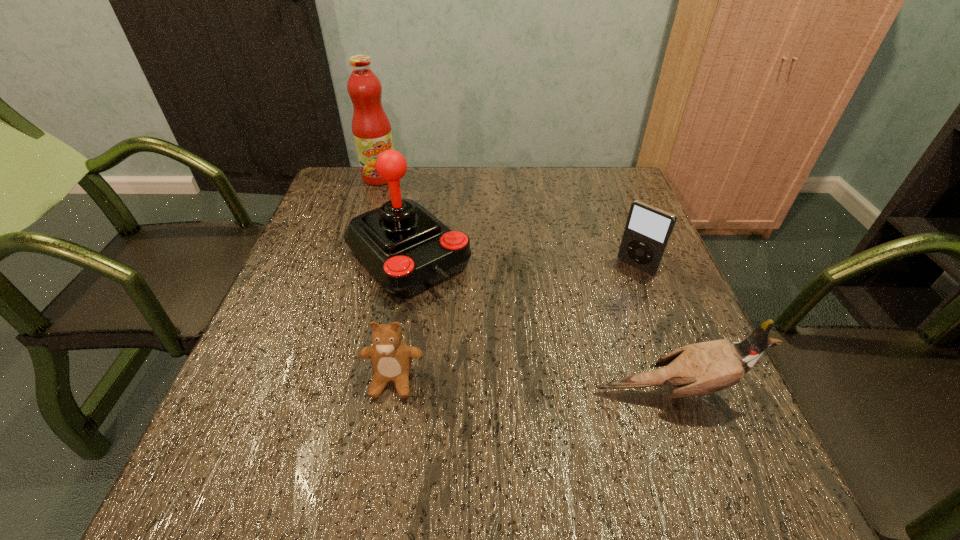
Find the location of `object that is the nearest to the second tallest object`. object that is the nearest to the second tallest object is located at coordinates (391, 358).

Where is `free space that satisfies the following two spatial constraints: 1. on the front-facing side of the shortest object; 2. at the face of the bird`? This screenshot has width=960, height=540. free space that satisfies the following two spatial constraints: 1. on the front-facing side of the shortest object; 2. at the face of the bird is located at coordinates (391, 392).

This screenshot has width=960, height=540. I want to click on vacant area in the image that satisfies the following two spatial constraints: 1. on the front side of the joystick; 2. at the face of the bird, so click(x=383, y=392).

Find the location of a particular element. The width and height of the screenshot is (960, 540). vacant space that satisfies the following two spatial constraints: 1. on the front-facing side of the shortest object; 2. at the face of the bird is located at coordinates (391, 392).

You are a GUI agent. You are given a task and a screenshot of the screen. Output one action in this format:
    pyautogui.click(x=<x>, y=<y>)
    Task: Click on the free space that satisfies the following two spatial constraints: 1. on the front-facing side of the shortest object; 2. at the face of the bird
    The width and height of the screenshot is (960, 540).
    Given the screenshot: What is the action you would take?
    pyautogui.click(x=391, y=392)